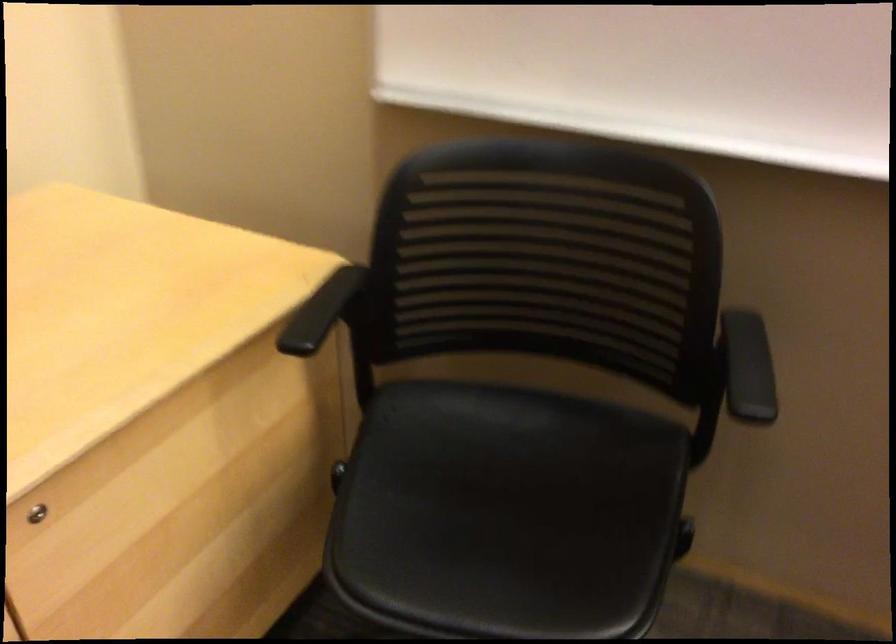
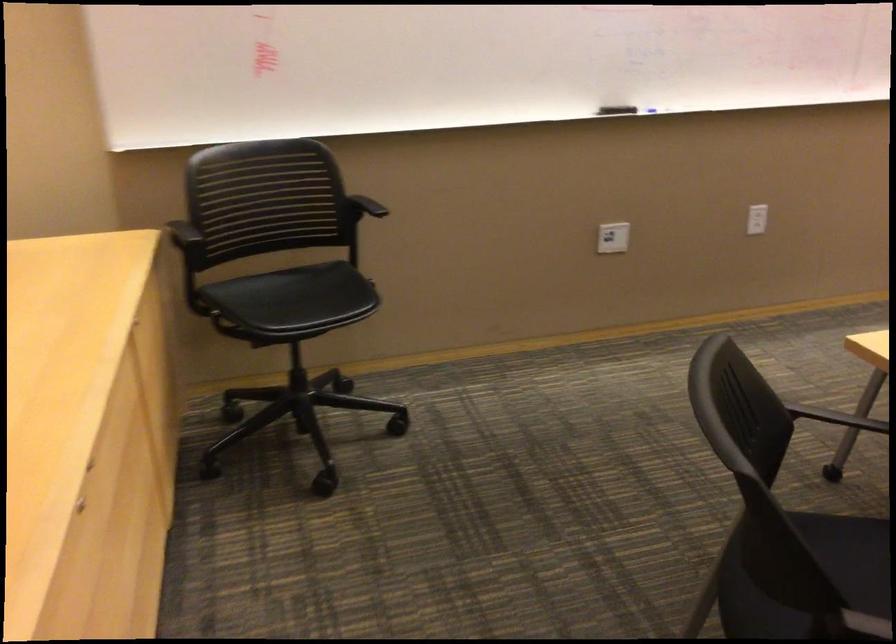
Locate, in the second image, the point that corresponds to the point at 737,333 in the first image.

(366, 205)